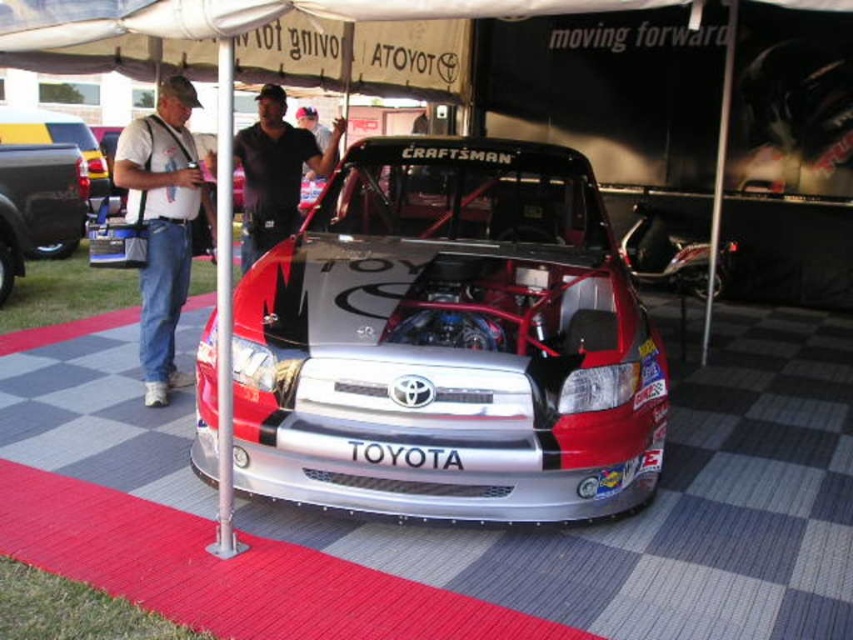
You are a photographer at an outdoor event. You need to capture a photo of the shiny metallic race car at center and the matte black truck at left. The camera you are using has a limited field of view. Can you determine which vehicle is wider so you can adjust your camera angle accordingly?

The shiny metallic race car at center might be wider than matte black truck at left, so you should adjust your camera angle to accommodate its width.

You are standing at the entrance of the event and see the shiny metallic race car at center and the black glossy truck at left. Which one is positioned to the right side of the other?

The shiny metallic race car at center is positioned to the right of the black glossy truck at left.